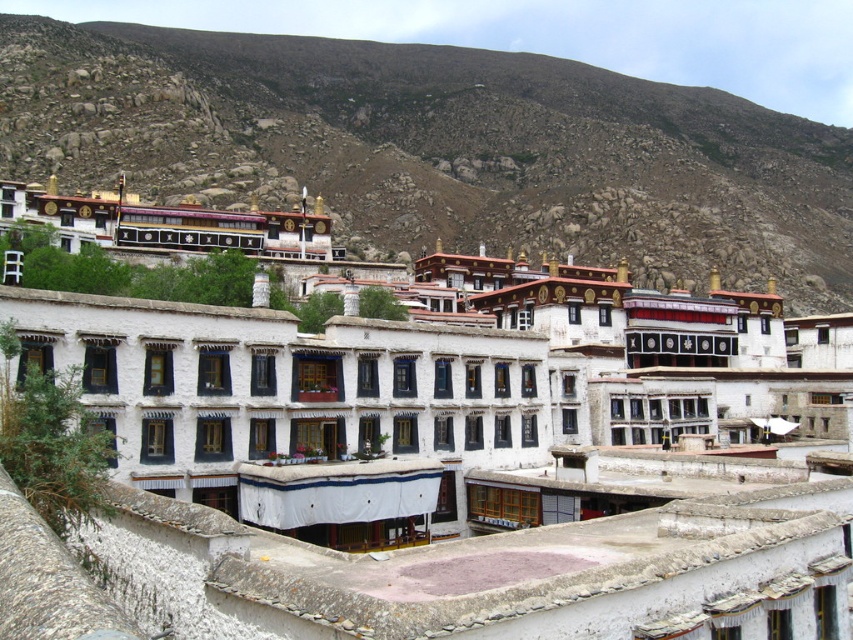
Does point (518, 364) lie in front of point (171, 140)?

Yes, it is.

Does white stone building at center appear on the right side of brown rocky hillside at upper center?

No, white stone building at center is not to the right of brown rocky hillside at upper center.

Is point (451, 580) closer to viewer compared to point (119, 76)?

Yes, it is in front of point (119, 76).

Where is `white stone building at center`? white stone building at center is located at coordinates (419, 483).